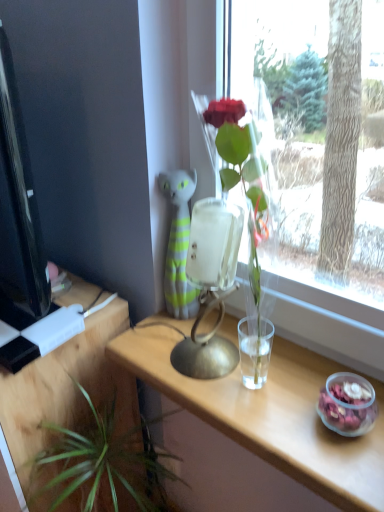
Question: Is wooden table at lower left, the 1th table in the left-to-right sequence, positioned far away from black glossy computer monitor at left?

Choices:
 (A) yes
 (B) no

Answer: (B)

Question: From the image's perspective, is wooden table at lower left, the 2th table when ordered from right to left, beneath black glossy computer monitor at left?

Choices:
 (A) yes
 (B) no

Answer: (A)

Question: Is wooden table at lower left, the 2th table when ordered from right to left, bigger than black glossy computer monitor at left?

Choices:
 (A) yes
 (B) no

Answer: (A)

Question: From a real-world perspective, does wooden table at lower left, the 1th table in the left-to-right sequence, sit lower than black glossy computer monitor at left?

Choices:
 (A) yes
 (B) no

Answer: (A)

Question: Is black glossy computer monitor at left completely or partially inside wooden table at lower left, the 2th table when ordered from right to left?

Choices:
 (A) yes
 (B) no

Answer: (B)

Question: Is wooden table at lower left, the 2th table when ordered from right to left, thinner than black glossy computer monitor at left?

Choices:
 (A) yes
 (B) no

Answer: (B)

Question: Is black glossy computer monitor at left facing towards wooden table at lower left, the 2th table when ordered from right to left?

Choices:
 (A) yes
 (B) no

Answer: (B)

Question: Is black glossy computer monitor at left bigger than wooden table at lower left, the 1th table in the left-to-right sequence?

Choices:
 (A) no
 (B) yes

Answer: (A)

Question: Considering the relative sizes of black glossy computer monitor at left and wooden table at lower left, the 2th table when ordered from right to left, in the image provided, is black glossy computer monitor at left thinner than wooden table at lower left, the 2th table when ordered from right to left,?

Choices:
 (A) yes
 (B) no

Answer: (A)

Question: Is black glossy computer monitor at left at the left side of wooden table at lower left, the 2th table when ordered from right to left?

Choices:
 (A) no
 (B) yes

Answer: (A)

Question: Considering the relative sizes of black glossy computer monitor at left and wooden table at lower left, the 2th table when ordered from right to left, in the image provided, is black glossy computer monitor at left wider than wooden table at lower left, the 2th table when ordered from right to left,?

Choices:
 (A) yes
 (B) no

Answer: (B)

Question: Is black glossy computer monitor at left shorter than wooden table at lower left, the 1th table in the left-to-right sequence?

Choices:
 (A) no
 (B) yes

Answer: (B)

Question: Considering the relative sizes of green leafy plant at lower left and clear wood table at center, the 1th table from the right, in the image provided, is green leafy plant at lower left shorter than clear wood table at center, the 1th table from the right,?

Choices:
 (A) yes
 (B) no

Answer: (B)